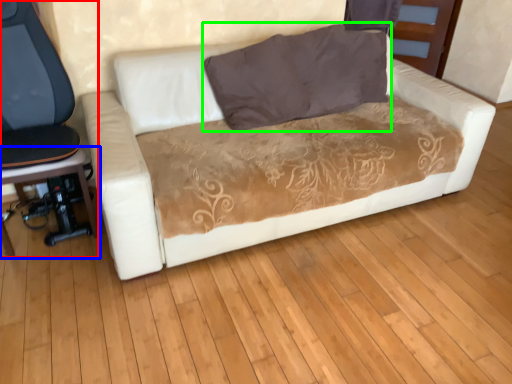
Question: Which object is the closest to the chair (highlighted by a red box)? Choose among these: music stool (highlighted by a blue box) or pillow (highlighted by a green box).

Choices:
 (A) music stool
 (B) pillow

Answer: (A)